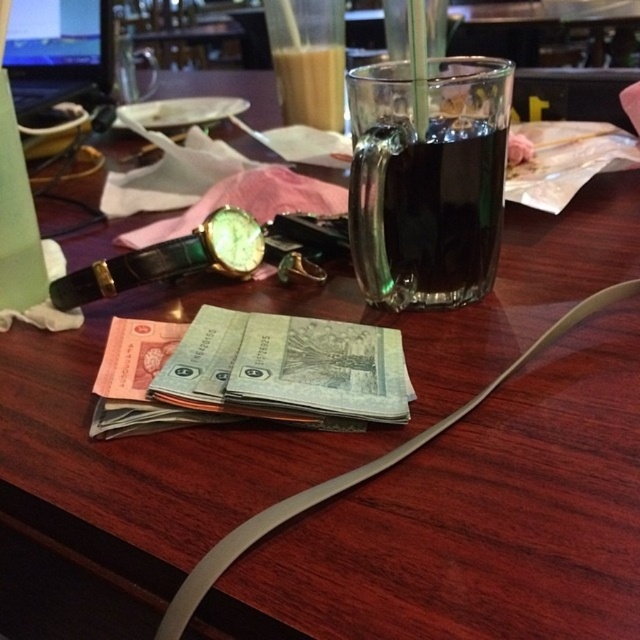
You are a customer at a cafe and want to choose between the dark glass mug at upper center and the translucent glass cup at upper center. Which one is taller?

The dark glass mug at upper center is much taller than the translucent glass cup at upper center.

You are a customer at a cafe and want to grab your drink. You see both the dark glass mug at upper center and the translucent glass cup at upper center. Which one is closer to you?

The dark glass mug at upper center is located below the translucent glass cup at upper center, so the translucent glass cup at upper center is closer to you.